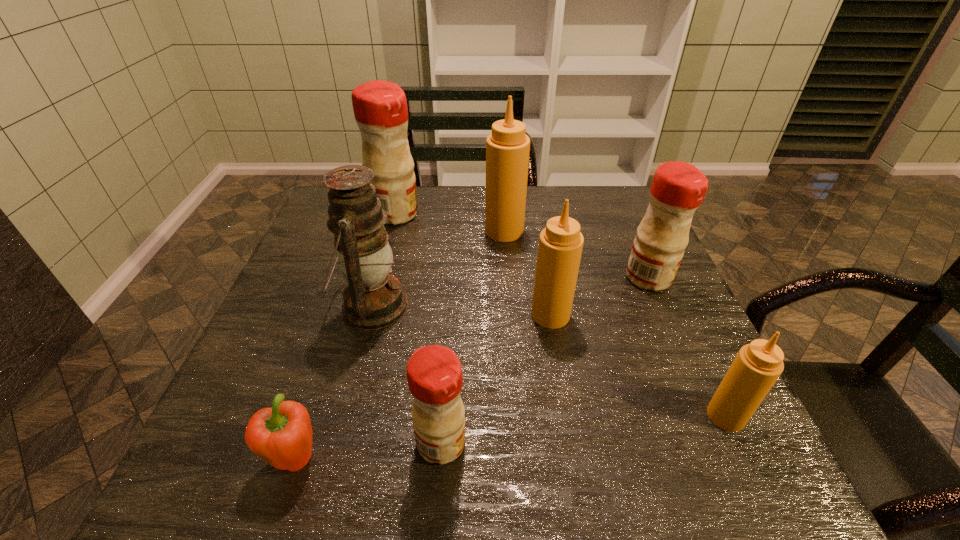
Image resolution: width=960 pixels, height=540 pixels. In order to click on the nearest red condiment in this screenshot , I will do `click(434, 373)`.

The height and width of the screenshot is (540, 960). What are the coordinates of `the fifth condiment from right to left` in the screenshot? It's located at (434, 373).

At what (x,y) coordinates should I click in order to perform the action: click on orange pepper. Please return your answer as a coordinate pair (x, y). Image resolution: width=960 pixels, height=540 pixels. Looking at the image, I should click on (281, 435).

I want to click on the shortest object, so click(x=281, y=435).

Identify the location of vacant space located 0.180m on the left of the farthest tan condiment. The height and width of the screenshot is (540, 960). (421, 231).

The width and height of the screenshot is (960, 540). I want to click on free space located 0.300m on the front of the biggest red condiment, so click(372, 300).

The image size is (960, 540). What are the coordinates of `free region located on the right of the lantern` in the screenshot? It's located at (503, 307).

The width and height of the screenshot is (960, 540). I want to click on vacant region located 0.060m on the right of the second farthest tan condiment, so click(x=596, y=315).

Locate an element on the screen. vacant position located 0.190m on the left of the rightmost red condiment is located at coordinates (549, 278).

Identify the location of free space located on the left of the rightmost tan condiment. This screenshot has width=960, height=540. (489, 416).